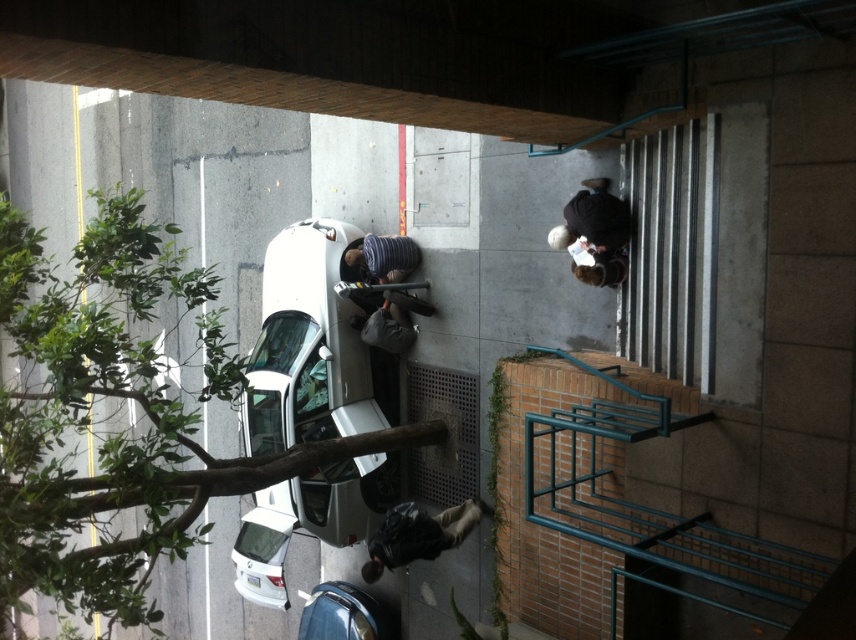
Can you confirm if brick overpass at upper center is taller than teal metal stairwell at upper right?

No.

Does brick overpass at upper center appear on the left side of teal metal stairwell at upper right?

Indeed, brick overpass at upper center is positioned on the left side of teal metal stairwell at upper right.

Locate an element on the screen. brick overpass at upper center is located at coordinates click(389, 54).

Identify the location of teal metal stairwell at upper right. The width and height of the screenshot is (856, 640). (617, 504).

Is point (601, 582) positioned after point (595, 284)?

No, (601, 582) is in front of (595, 284).

Is point (584, 490) positioned behind point (617, 234)?

No, (584, 490) is closer to viewer.

This screenshot has width=856, height=640. Find the location of `teal metal stairwell at upper right`. teal metal stairwell at upper right is located at coordinates (617, 504).

Is green leafy tree at lower left smaller than teal metal stairwell at upper right?

No, green leafy tree at lower left is not smaller than teal metal stairwell at upper right.

Is green leafy tree at lower left below teal metal stairwell at upper right?

Yes.

In order to click on green leafy tree at lower left in this screenshot , I will do `click(111, 417)`.